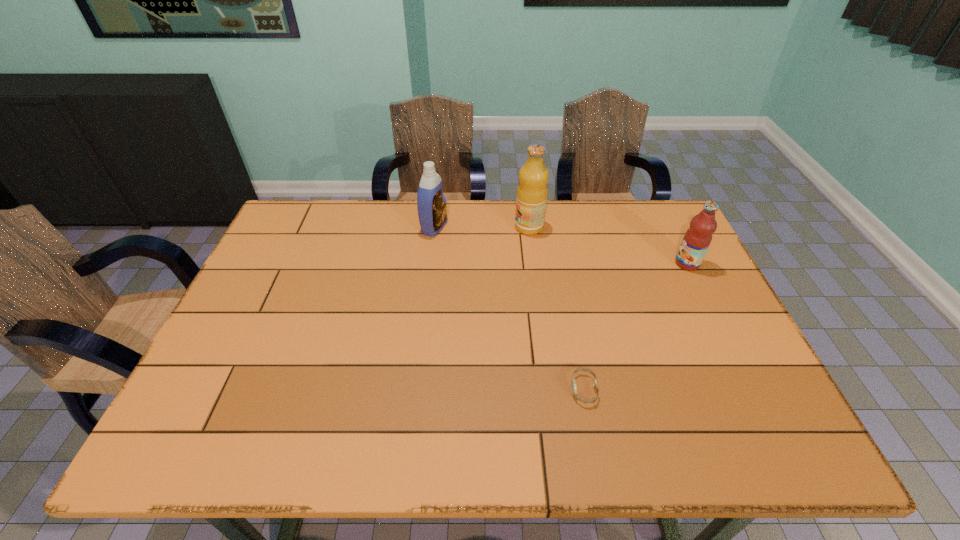
In the image, there is a desktop. Where is `vacant space at the far edge`? vacant space at the far edge is located at coordinates (447, 212).

The width and height of the screenshot is (960, 540). In the image, there is a desktop. Find the location of `vacant space at the near edge`. vacant space at the near edge is located at coordinates (597, 434).

This screenshot has width=960, height=540. Find the location of `vacant space at the left edge of the desktop`. vacant space at the left edge of the desktop is located at coordinates 302,258.

What are the coordinates of `vacant space at the right edge` in the screenshot? It's located at (682, 314).

This screenshot has height=540, width=960. What are the coordinates of `free space at the far left corner of the desktop` in the screenshot? It's located at (293, 216).

The width and height of the screenshot is (960, 540). Identify the location of free spot between the shortest object and the left fruit juice. (557, 308).

I want to click on vacant space that's between the detergent and the left fruit juice, so click(x=482, y=227).

Identify the location of vacant space that is in between the tallest object and the right fruit juice. Image resolution: width=960 pixels, height=540 pixels. (608, 245).

Find the location of a particular element. The image size is (960, 540). vacant space in between the detergent and the shorter fruit juice is located at coordinates (x=561, y=245).

At what (x,y) coordinates should I click in order to perform the action: click on free space that is in between the detergent and the farther fruit juice. Please return your answer as a coordinate pair (x, y). The height and width of the screenshot is (540, 960). Looking at the image, I should click on (482, 227).